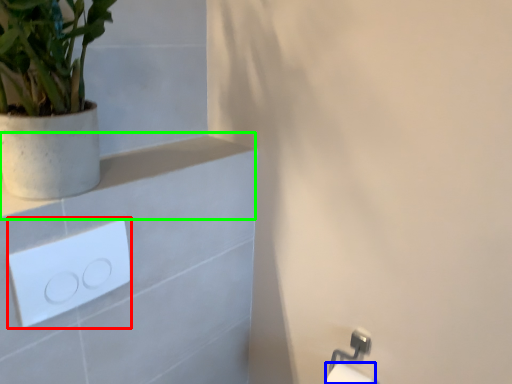
Question: Based on their relative distances, which object is nearer to light switch (highlighted by a red box)? Choose from toilet paper (highlighted by a blue box) and balustrade (highlighted by a green box).

Choices:
 (A) toilet paper
 (B) balustrade

Answer: (B)